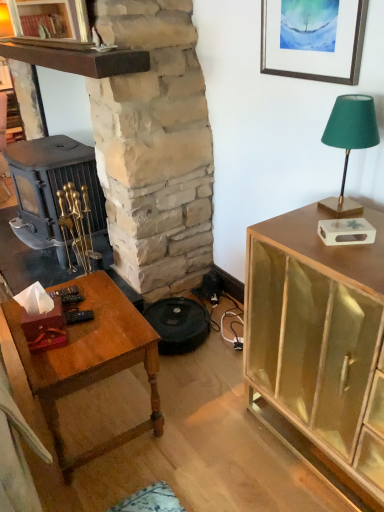
At what (x,y) coordinates should I click in order to perform the action: click on spots to the right of wooden table at lower left. Please return your answer as a coordinate pair (x, y). The height and width of the screenshot is (512, 384). Looking at the image, I should click on (196, 416).